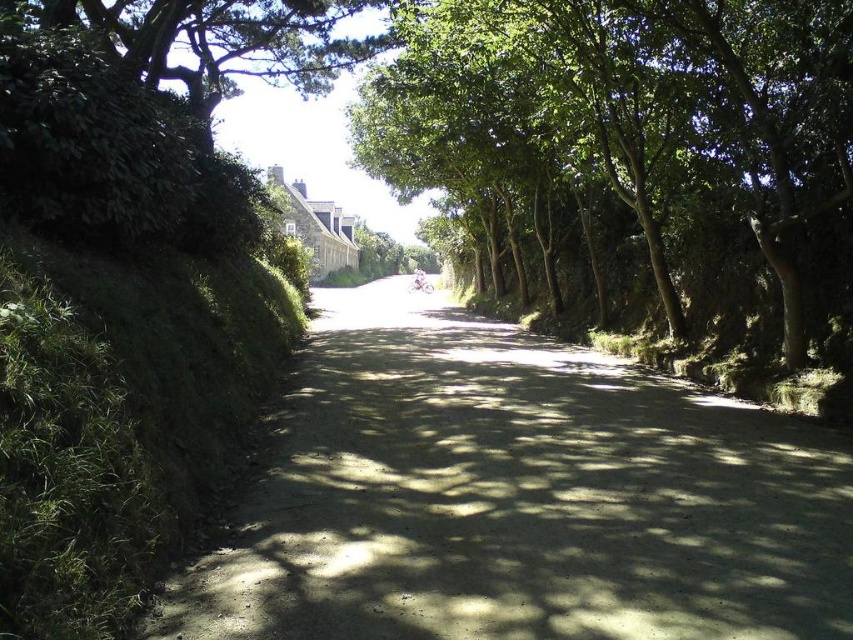
Is dirt road at center smaller than green leafy tree at center?

Correct, dirt road at center occupies less space than green leafy tree at center.

Who is shorter, dirt road at center or green leafy tree at center?

dirt road at center is shorter.

Where is `dirt road at center`? dirt road at center is located at coordinates (517, 497).

Is green leafy tree at center wider than green leafy tree at upper left?

No, green leafy tree at center is not wider than green leafy tree at upper left.

Is green leafy tree at center below green leafy tree at upper left?

Indeed, green leafy tree at center is positioned under green leafy tree at upper left.

The image size is (853, 640). What are the coordinates of `green leafy tree at center` in the screenshot? It's located at (634, 154).

Does dirt road at center appear under green leafy tree at upper left?

Yes.

Does dirt road at center appear on the right side of green leafy tree at upper left?

Indeed, dirt road at center is positioned on the right side of green leafy tree at upper left.

Which is behind, point (329, 609) or point (146, 61)?

Positioned behind is point (146, 61).

Image resolution: width=853 pixels, height=640 pixels. Find the location of `dirt road at center`. dirt road at center is located at coordinates (517, 497).